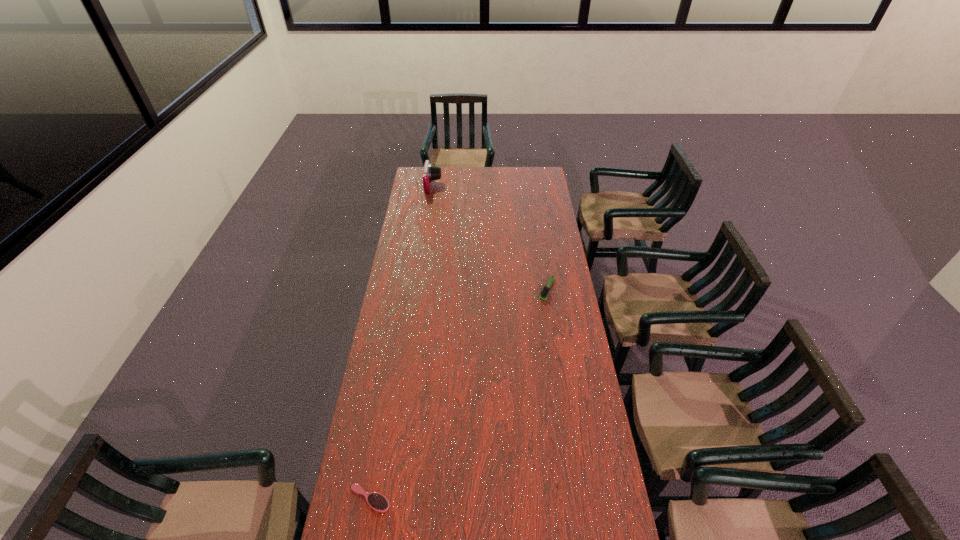
Locate an element on the screen. The width and height of the screenshot is (960, 540). vacant space that is in between the nearer hairbrush and the second nearest object is located at coordinates (458, 394).

Where is `vacant space that is in between the shortest object and the right hairbrush`? vacant space that is in between the shortest object and the right hairbrush is located at coordinates (458, 394).

I want to click on unoccupied area between the shortest object and the camera, so click(x=401, y=342).

Locate an element on the screen. The height and width of the screenshot is (540, 960). free point between the tallest object and the nearer hairbrush is located at coordinates (401, 342).

This screenshot has width=960, height=540. What are the coordinates of `free space between the taller hairbrush and the left hairbrush` in the screenshot? It's located at (458, 394).

I want to click on empty space between the shortest object and the taller hairbrush, so tap(458, 394).

The image size is (960, 540). Find the location of `object that is the closest to the nearest object`. object that is the closest to the nearest object is located at coordinates (545, 291).

Locate which object is the closest to the second shortest object. Please provide its 2D coordinates. Your answer should be formatted as a tuple, i.e. [(x, y)], where the tuple contains the x and y coordinates of a point satisfying the conditions above.

[(431, 172)]

Where is `vacant space that satisfies the following two spatial constraints: 1. on the front-facing side of the right hairbrush; 2. on the right side of the camera`? vacant space that satisfies the following two spatial constraints: 1. on the front-facing side of the right hairbrush; 2. on the right side of the camera is located at coordinates (419, 289).

Where is `free space that satisfies the following two spatial constraints: 1. on the back side of the second farthest object; 2. on the front-facing side of the farthest object`? This screenshot has height=540, width=960. free space that satisfies the following two spatial constraints: 1. on the back side of the second farthest object; 2. on the front-facing side of the farthest object is located at coordinates 531,186.